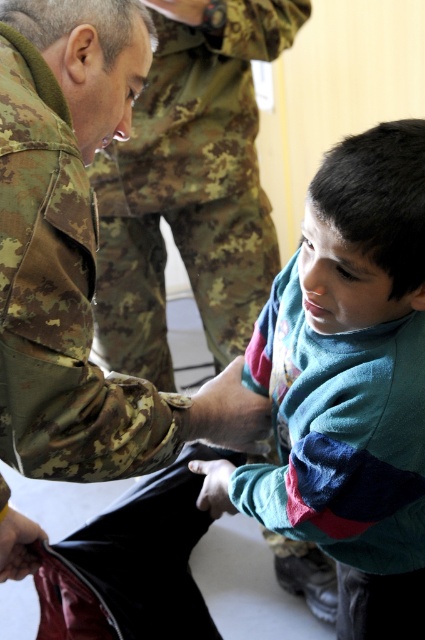
Question: Which of the following is the closest to the observer?

Choices:
 (A) teal soft sweater at center
 (B) camouflage fabric uniform at upper left

Answer: (A)

Question: Is teal soft sweater at center smaller than camouflage fabric uniform at upper left?

Choices:
 (A) no
 (B) yes

Answer: (B)

Question: Does teal soft sweater at center appear on the right side of camouflage fabric uniform at upper left?

Choices:
 (A) no
 (B) yes

Answer: (B)

Question: Does teal soft sweater at center appear over camouflage fabric uniform at upper left?

Choices:
 (A) yes
 (B) no

Answer: (B)

Question: Which object is closer to the camera taking this photo?

Choices:
 (A) camouflage fabric uniform at upper left
 (B) teal soft sweater at center

Answer: (B)